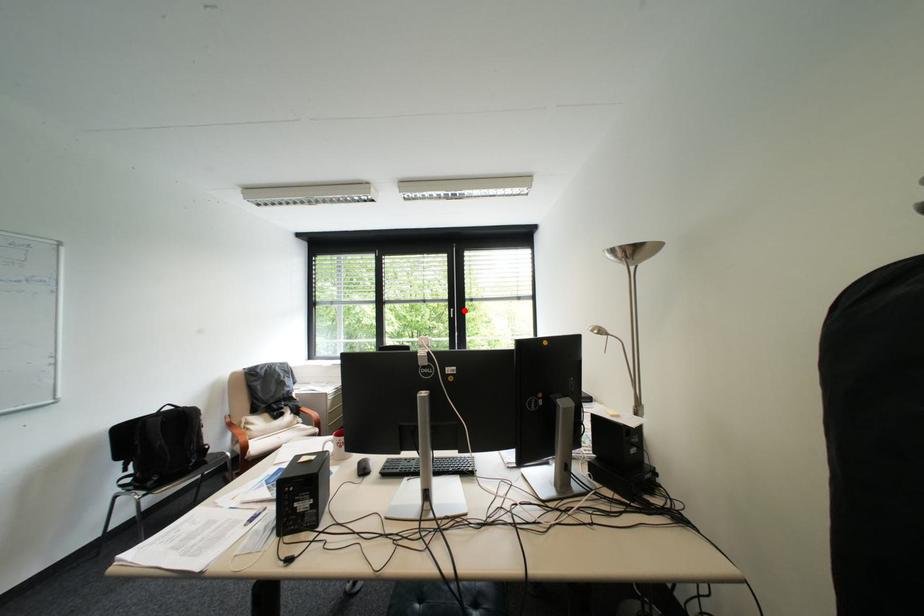
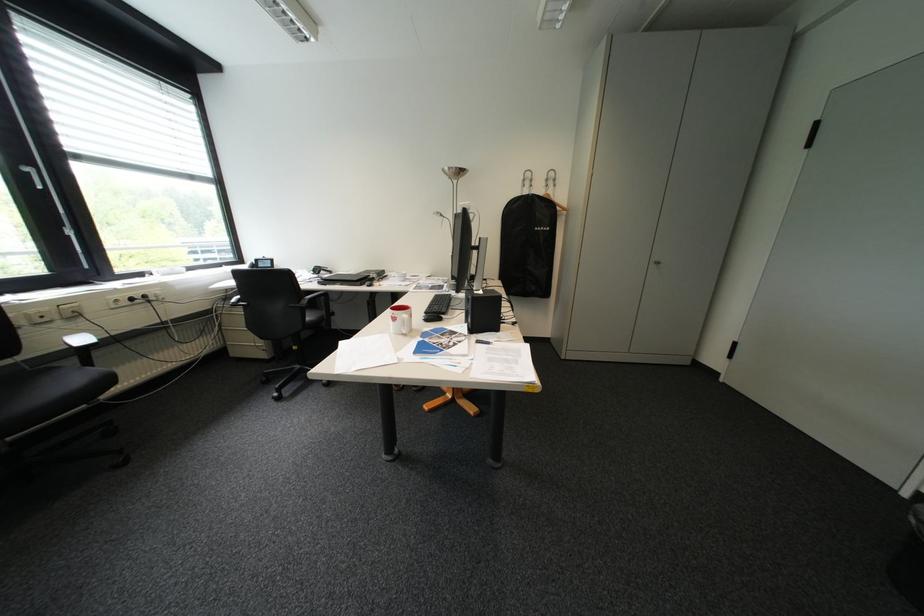
Question: A red point is marked in image1. In image2, is the corresponding 3D point closer to the camera or farther? Reply with the corresponding letter.

Choices:
 (A) The corresponding 3D point is closer.
 (B) The corresponding 3D point is farther.

Answer: (B)